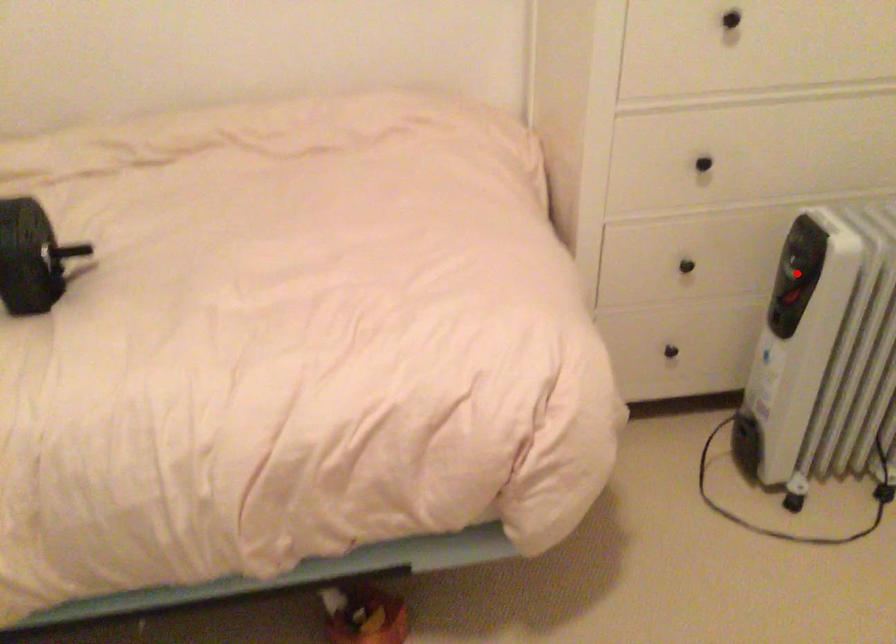
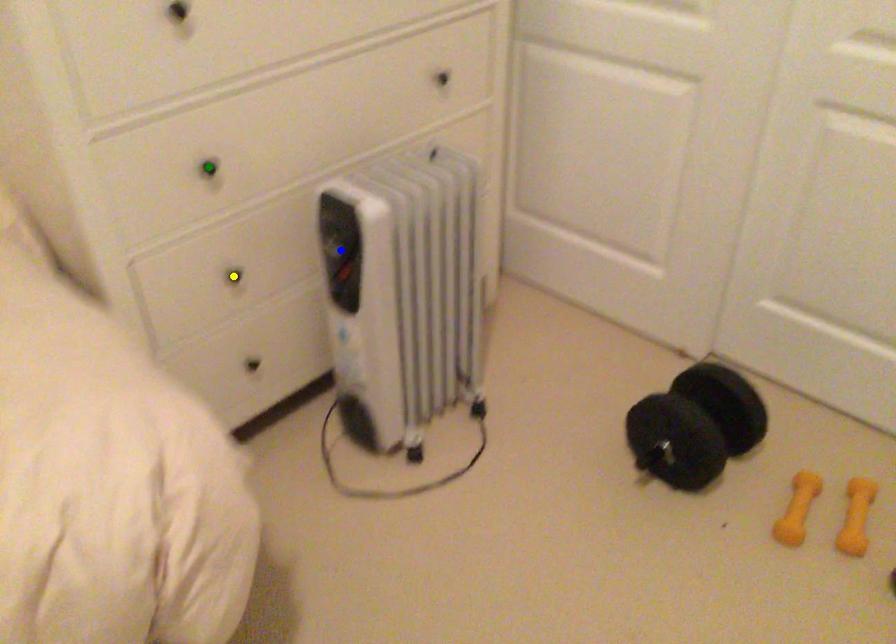
Question: I am providing you with two images of the same scene from different viewpoints. A red point is marked on the first image. You are given multiple points on the second image. Which spot in image 2 lines up with the point in image 1?

Choices:
 (A) yellow point
 (B) blue point
 (C) green point

Answer: (B)